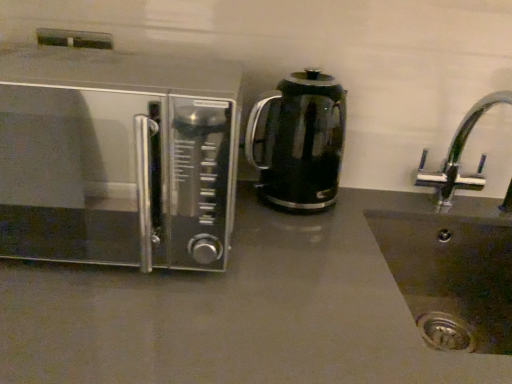
Where is `blank space to the left of chrome metallic faucet at right`? This screenshot has width=512, height=384. blank space to the left of chrome metallic faucet at right is located at coordinates (359, 222).